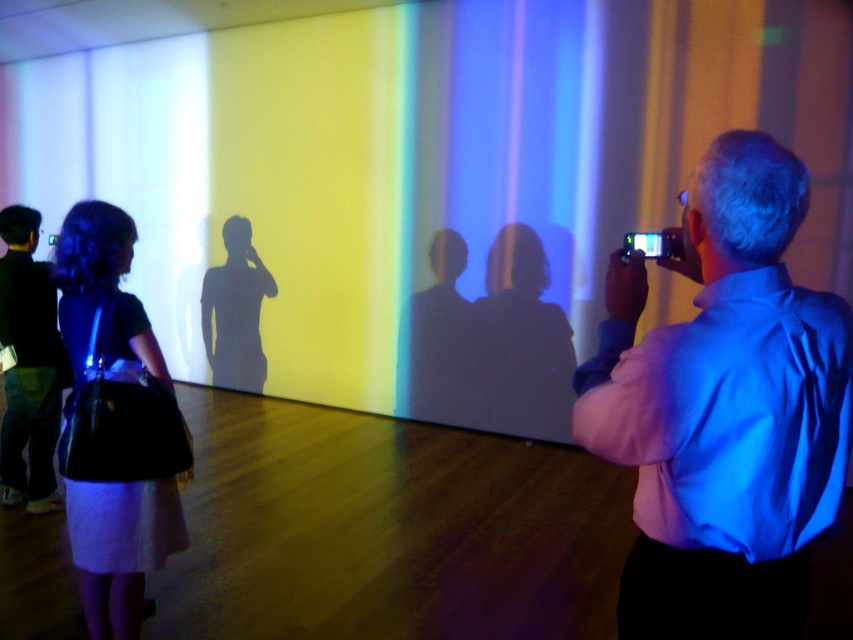
Question: Among these points, which one is nearest to the camera?

Choices:
 (A) (7, 410)
 (B) (686, 422)

Answer: (B)

Question: Estimate the real-world distances between objects in this image. Which object is closer to the dark blue jeans at lower left?

Choices:
 (A) matte black dress at left
 (B) blue satin shirt at right

Answer: (A)

Question: Is matte black dress at left positioned in front of dark blue jeans at lower left?

Choices:
 (A) yes
 (B) no

Answer: (A)

Question: Does matte black dress at left appear under dark blue jeans at lower left?

Choices:
 (A) yes
 (B) no

Answer: (A)

Question: Which of the following is the farthest from the observer?

Choices:
 (A) (100, 301)
 (B) (601, 337)
 (C) (32, 477)

Answer: (C)

Question: Does blue satin shirt at right appear on the right side of dark blue jeans at lower left?

Choices:
 (A) no
 (B) yes

Answer: (B)